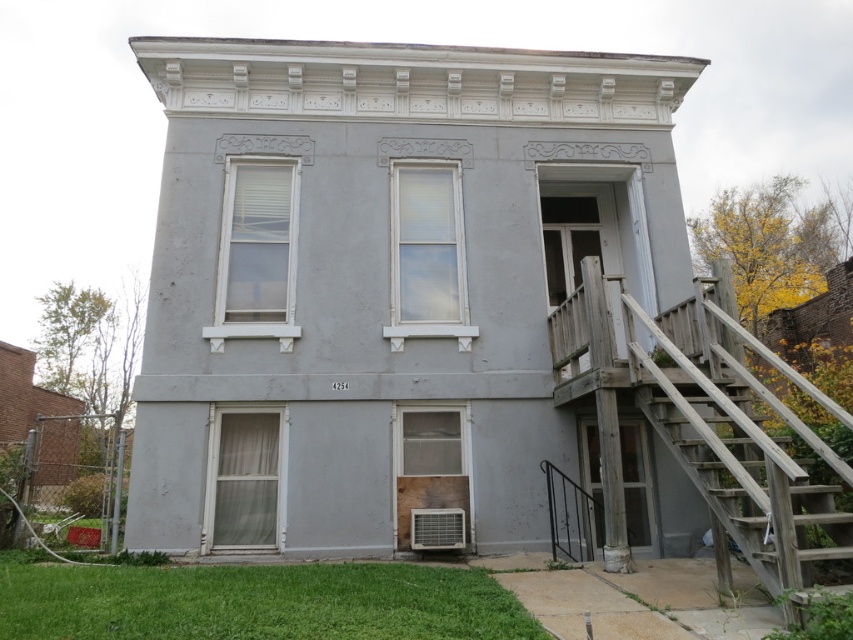
Question: Does weathered wood stairs at right have a smaller size compared to black metal rail at lower right?

Choices:
 (A) yes
 (B) no

Answer: (B)

Question: Which point appears closest to the camera in this image?

Choices:
 (A) (805, 509)
 (B) (579, 488)

Answer: (A)

Question: From the image, what is the correct spatial relationship of weathered wood stairs at right in relation to black metal rail at lower right?

Choices:
 (A) right
 (B) left

Answer: (A)

Question: Does weathered wood stairs at right appear on the right side of black metal rail at lower right?

Choices:
 (A) no
 (B) yes

Answer: (B)